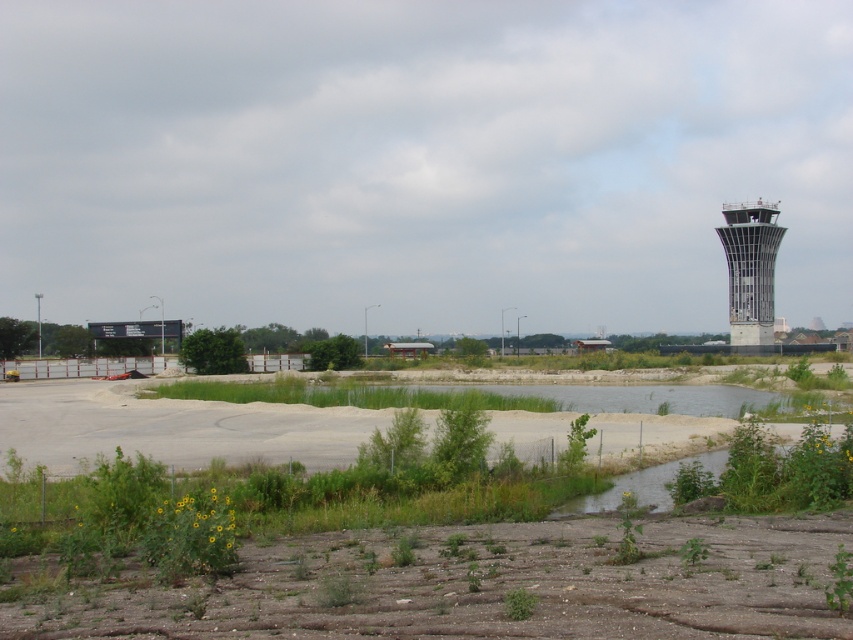
Question: Does gray sandy dirt field at lower center appear over metallic glass control tower at right?

Choices:
 (A) yes
 (B) no

Answer: (B)

Question: Observing the image, what is the correct spatial positioning of gray sandy dirt field at lower center in reference to metallic glass control tower at right?

Choices:
 (A) below
 (B) above

Answer: (A)

Question: In this image, where is gray sandy dirt field at lower center located relative to metallic glass control tower at right?

Choices:
 (A) right
 (B) left

Answer: (B)